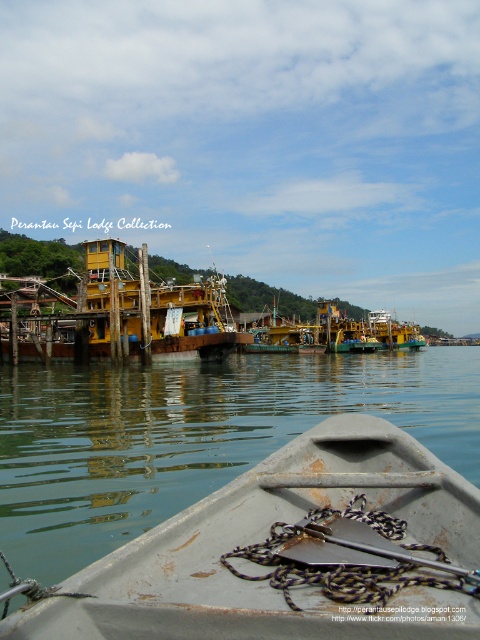
You are standing on the yellow matte dock at center and want to reach the yellow matte boat at center. Given that the average walking speed is 3 feet per second, how many seconds will it take you to walk to the boat?

The yellow matte dock at center is 84.18 feet away from the yellow matte boat at center. At a walking speed of 3 feet per second, dividing the distance by the speed gives 84.18 divided by 3 equals 28.06 seconds. Therefore, it will take approximately 28 seconds to walk to the boat.

You are standing on the yellow matte dock at center. Based on the coordinates provided, can you determine your exact position relative to the waterfront scene?

The yellow matte dock at center is located at coordinates point (141, 308), so you are positioned at that exact point in the waterfront scene.

You are on a boat tour and need to determine the best route to avoid obstacles. Which boat is closer to you, the gray metallic boat at lower center or the yellow matte boat at center?

The gray metallic boat at lower center is closer to you than the yellow matte boat at center, so you should adjust your course to steer clear of it first.